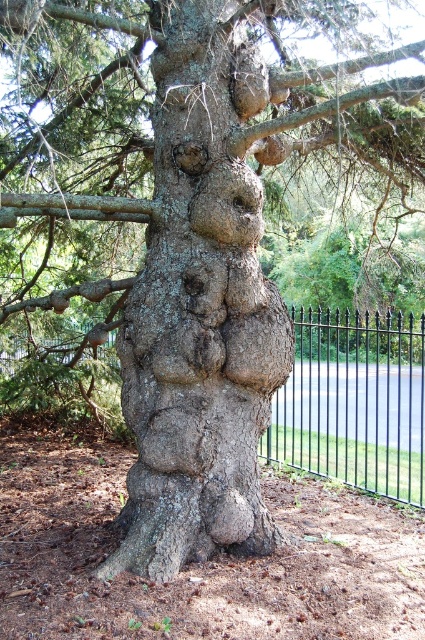
You are a gardener trying to determine if the gray rough bark tree trunk at center is blocking the view of the black wrought iron fence at center. Based on the scene, can you see the fence through the tree trunk?

The gray rough bark tree trunk at center is positioned over black wrought iron fence at center, so the tree trunk is blocking the view of the fence.

You are a landscape architect designing a garden path that needs to pass between the gray rough bark tree trunk at center and the black wrought iron fence at center. Given their sizes, which one should you place closer to the path to ensure it remains accessible for wheelchairs?

The gray rough bark tree trunk at center is smaller than the black wrought iron fence at center, so you should place the tree trunk closer to the path to ensure accessibility since it occupies less space.